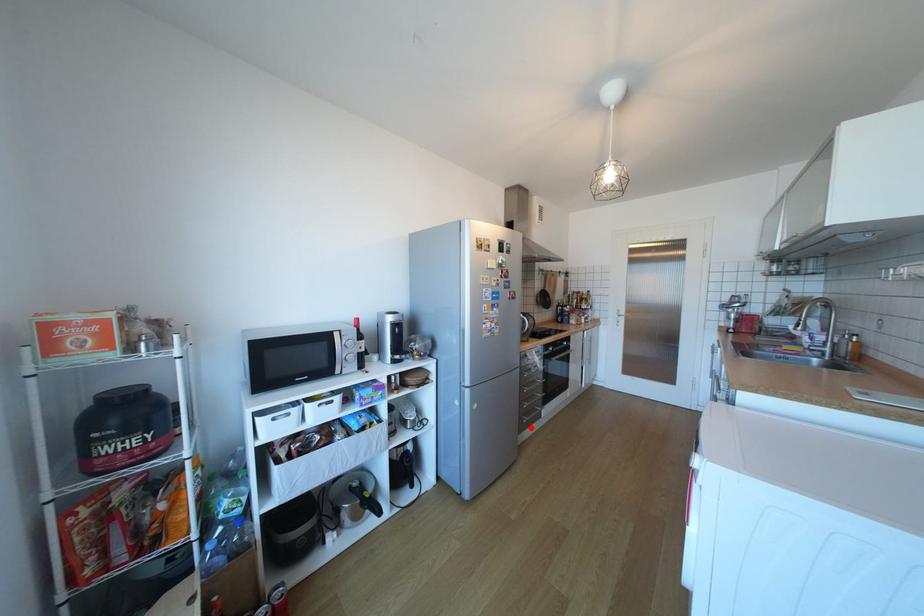
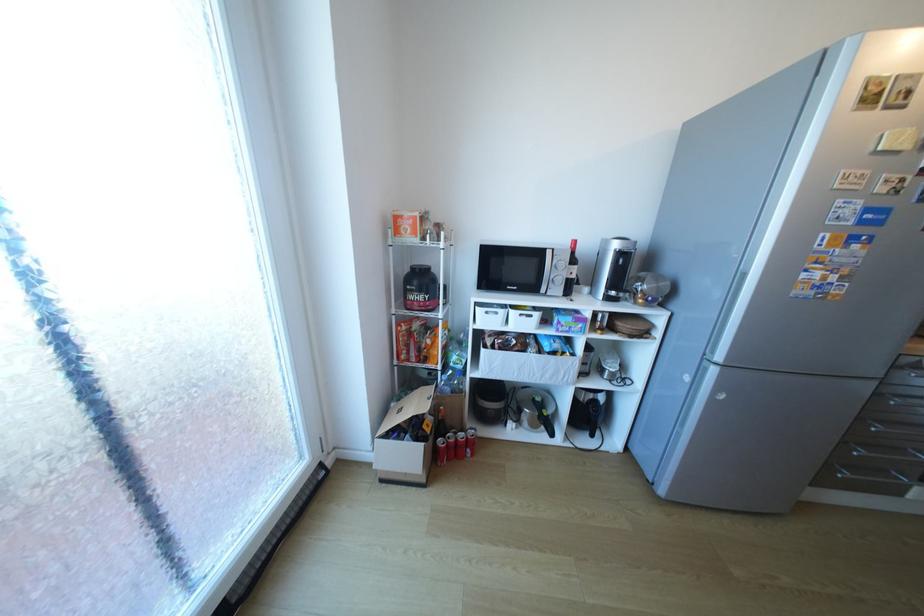
Where in the second image is the point corresponding to the highlighted location from the first image?

(834, 480)